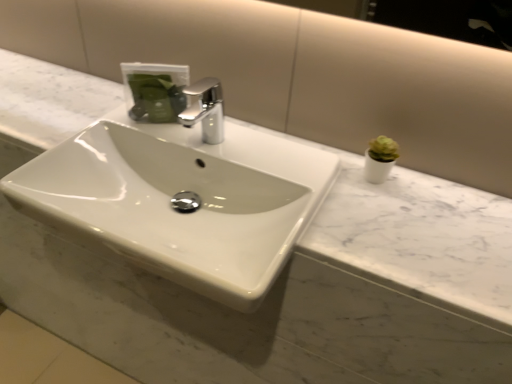
Question: Visually, is chrome metallic faucet at center positioned to the left or to the right of white glossy sink at center?

Choices:
 (A) left
 (B) right

Answer: (B)

Question: Is chrome metallic faucet at center bigger or smaller than white glossy sink at center?

Choices:
 (A) big
 (B) small

Answer: (B)

Question: From a real-world perspective, is chrome metallic faucet at center above or below white glossy sink at center?

Choices:
 (A) below
 (B) above

Answer: (B)

Question: Is point (290, 193) closer or farther from the camera than point (190, 87)?

Choices:
 (A) farther
 (B) closer

Answer: (B)

Question: Considering their positions, is white glossy sink at center located in front of or behind chrome metallic faucet at center?

Choices:
 (A) front
 (B) behind

Answer: (A)

Question: From a real-world perspective, is white glossy sink at center physically located above or below chrome metallic faucet at center?

Choices:
 (A) below
 (B) above

Answer: (A)

Question: From their relative heights in the image, would you say white glossy sink at center is taller or shorter than chrome metallic faucet at center?

Choices:
 (A) short
 (B) tall

Answer: (B)